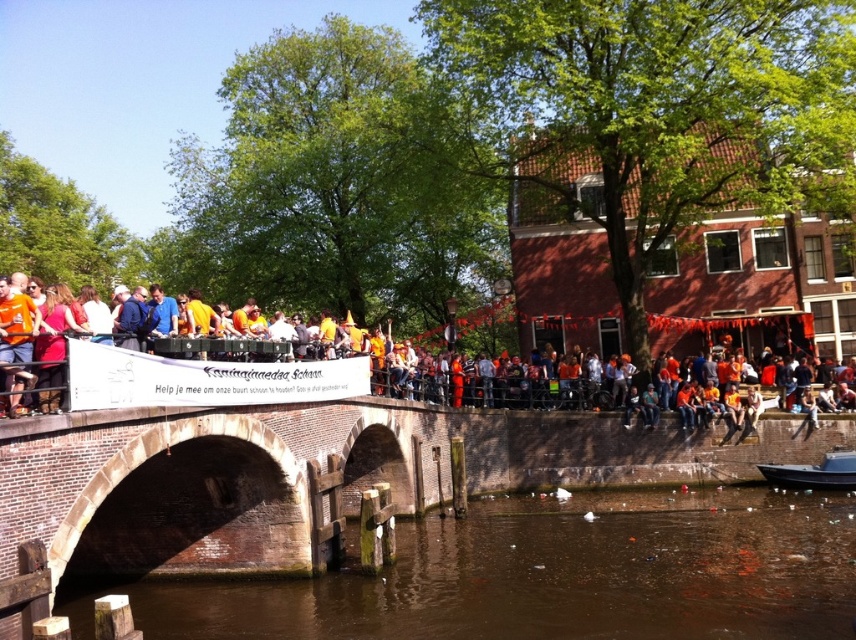
Question: Does brown murky water at lower center have a greater width compared to orange fabric banner at center?

Choices:
 (A) yes
 (B) no

Answer: (B)

Question: Is brown murky water at lower center to the right of orange fabric banner at center from the viewer's perspective?

Choices:
 (A) no
 (B) yes

Answer: (B)

Question: Which point is closer to the camera?

Choices:
 (A) brown murky water at lower center
 (B) black glossy boat at lower right

Answer: (A)

Question: Which point appears closest to the camera in this image?

Choices:
 (A) (824, 452)
 (B) (388, 621)

Answer: (B)

Question: Can you confirm if orange fabric banner at center is wider than black glossy boat at lower right?

Choices:
 (A) no
 (B) yes

Answer: (B)

Question: Which object appears farthest from the camera in this image?

Choices:
 (A) brown murky water at lower center
 (B) black glossy boat at lower right
 (C) orange fabric banner at center

Answer: (B)